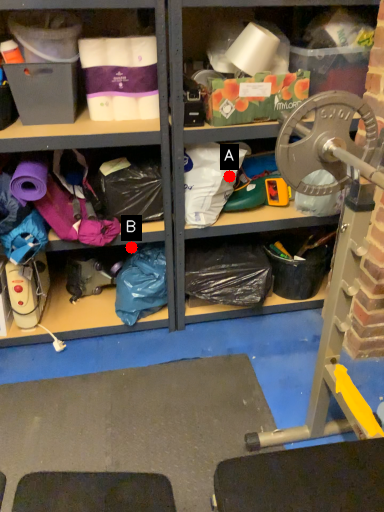
Question: Two points are circled on the image, labeled by A and B beside each circle. Which point is farther to the camera?

Choices:
 (A) A is further
 (B) B is further

Answer: (B)